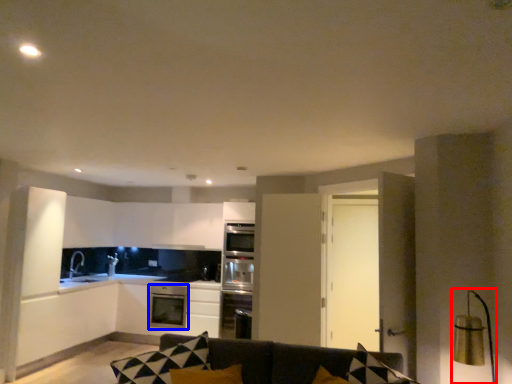
Question: Which of the following is the closest to the observer, light fixture (highlighted by a red box) or dish washer (highlighted by a blue box)?

Choices:
 (A) light fixture
 (B) dish washer

Answer: (A)